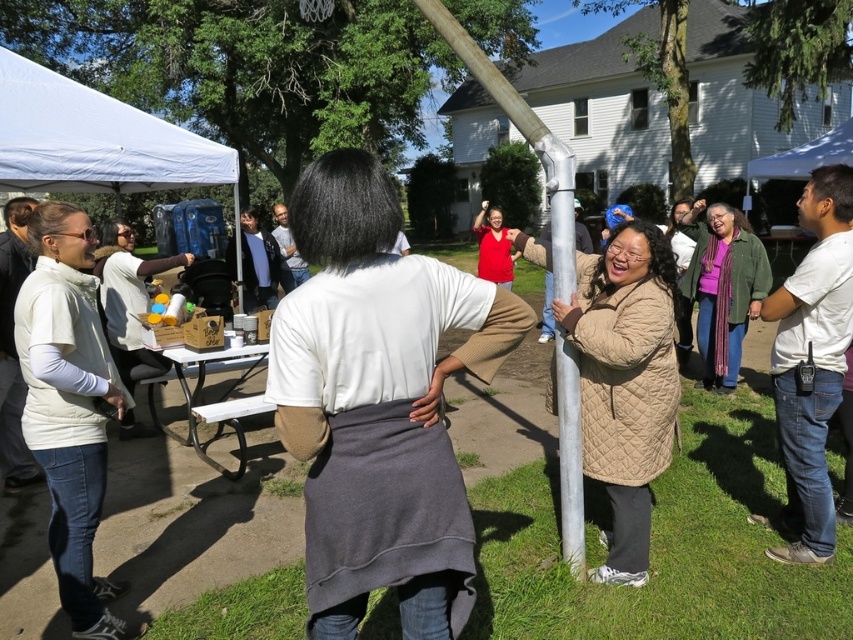
Question: Can you confirm if white fabric canopy at upper left is positioned below white plastic picnic table at lower left?

Choices:
 (A) no
 (B) yes

Answer: (A)

Question: Is white fleece vest at left to the left of matte red shirt at center from the viewer's perspective?

Choices:
 (A) no
 (B) yes

Answer: (B)

Question: Observing the image, what is the correct spatial positioning of green quilted jacket at center in reference to white plastic picnic table at lower left?

Choices:
 (A) left
 (B) right

Answer: (B)

Question: Estimate the real-world distances between objects in this image. Which object is farther from the white fleece vest at left?

Choices:
 (A) white fabric canopy at upper left
 (B) quilted beige coat at center
 (C) white cotton shirt at center
 (D) green quilted jacket at center

Answer: (D)

Question: Which object is farther from the camera taking this photo?

Choices:
 (A) white plastic picnic table at lower left
 (B) white cotton shirt at center
 (C) white fleece vest at left
 (D) quilted beige coat at center

Answer: (A)

Question: Which object appears farthest from the camera in this image?

Choices:
 (A) white cotton shirt at center
 (B) white fleece vest at left
 (C) matte red shirt at center

Answer: (C)